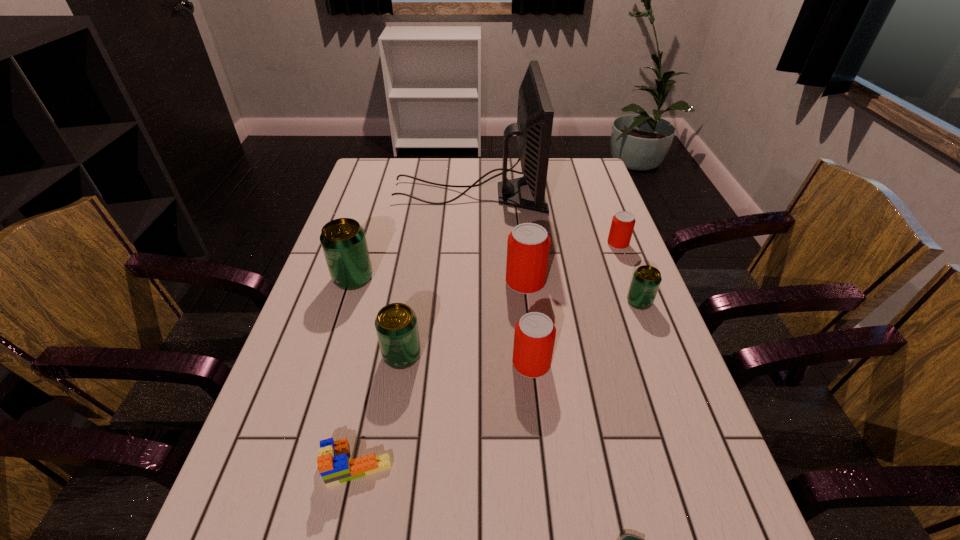
Identify the location of vacant area at the far left corner of the desktop. (372, 172).

Locate an element on the screen. vacant space at the far right corner is located at coordinates (568, 158).

Where is `vacant region between the second farthest red beer can and the Lego`? The width and height of the screenshot is (960, 540). vacant region between the second farthest red beer can and the Lego is located at coordinates (441, 374).

The image size is (960, 540). I want to click on free spot between the Lego and the second smallest red beer can, so click(444, 415).

Where is `free space between the rightmost green beer can and the farthest red beer can`? free space between the rightmost green beer can and the farthest red beer can is located at coordinates (629, 273).

Identify the location of blank region between the nearest green beer can and the second biggest red beer can. Image resolution: width=960 pixels, height=540 pixels. (467, 360).

The image size is (960, 540). I want to click on unoccupied area between the farthest object and the second nearest green beer can, so click(555, 248).

Locate an element on the screen. This screenshot has height=540, width=960. free space between the orange Lego and the rightmost green beer can is located at coordinates (498, 383).

At what (x,y) coordinates should I click in order to perform the action: click on free space between the second shortest object and the second farthest red beer can. Please return your answer as a coordinate pair (x, y). Looking at the image, I should click on (441, 374).

Where is `free space between the rightmost red beer can and the eighth tallest object`? Image resolution: width=960 pixels, height=540 pixels. free space between the rightmost red beer can and the eighth tallest object is located at coordinates (487, 355).